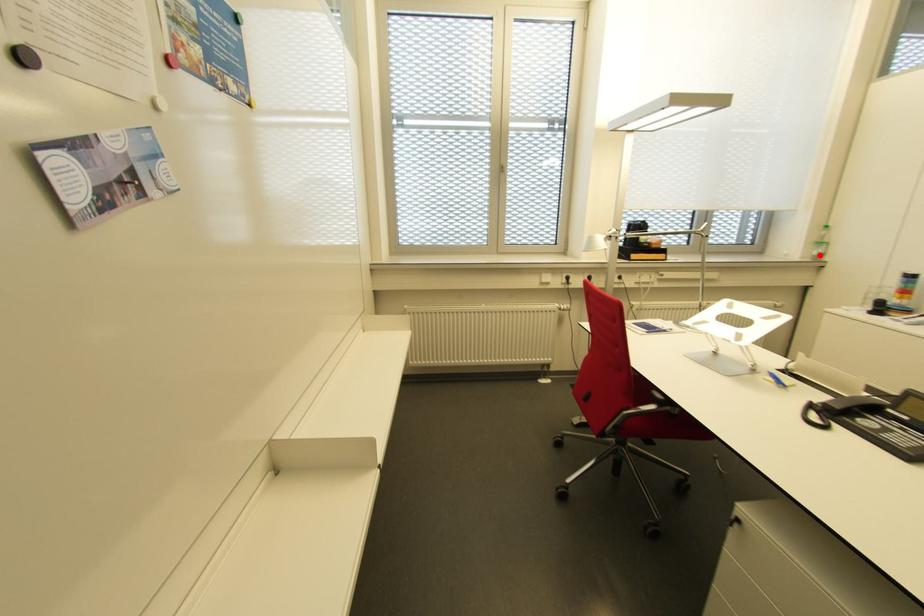
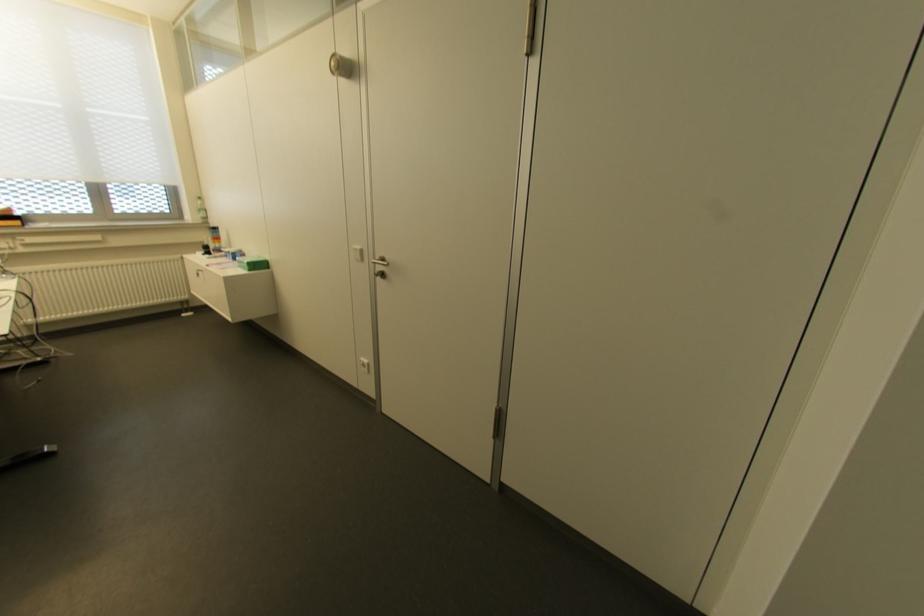
The point at the highlighted location is marked in the first image. Where is the corresponding point in the second image?

(204, 217)